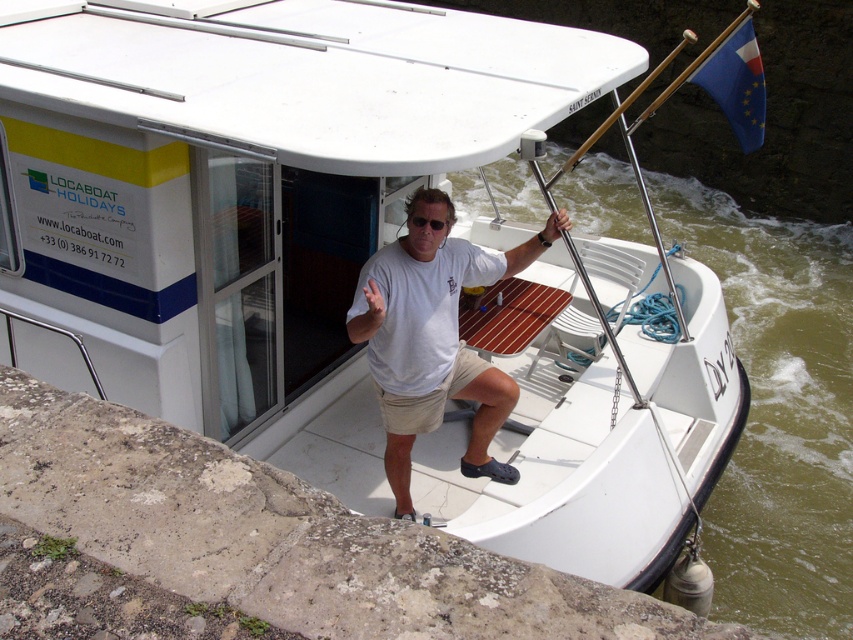
Question: Is green water at lower right positioned before white cotton shirt at center?

Choices:
 (A) no
 (B) yes

Answer: (A)

Question: Which object is closer to the camera taking this photo?

Choices:
 (A) stone textured ledge at lower left
 (B) white cotton shirt at center

Answer: (A)

Question: Which point is farther to the camera?

Choices:
 (A) stone textured ledge at lower left
 (B) green water at lower right
 (C) white cotton shirt at center

Answer: (B)

Question: Can you confirm if green water at lower right is bigger than white cotton shirt at center?

Choices:
 (A) yes
 (B) no

Answer: (A)

Question: Can you confirm if stone textured ledge at lower left is positioned above green water at lower right?

Choices:
 (A) no
 (B) yes

Answer: (A)

Question: Which point is closer to the camera taking this photo?

Choices:
 (A) (732, 506)
 (B) (450, 252)

Answer: (B)